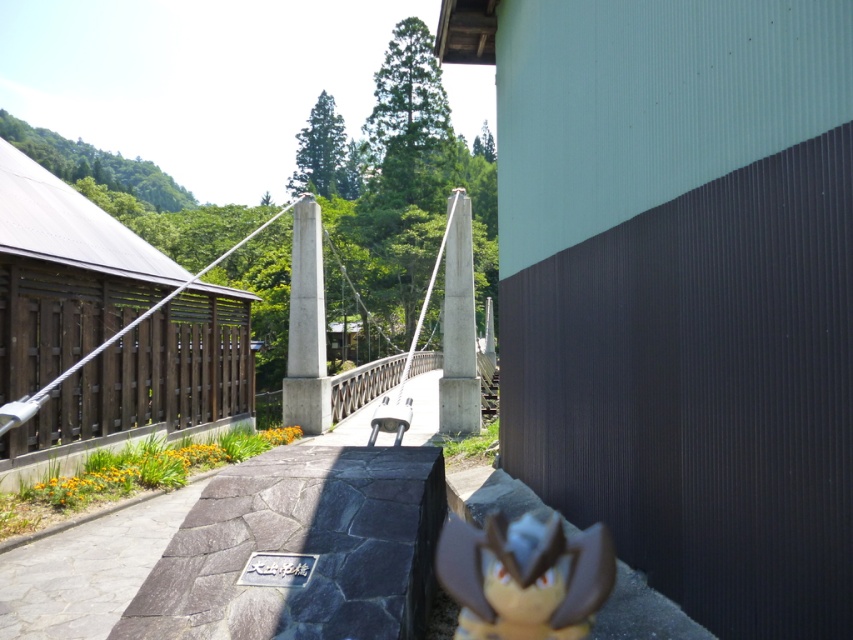
Question: Which point is closer to the camera taking this photo?

Choices:
 (A) (503, 614)
 (B) (369, 371)

Answer: (A)

Question: Does silver metallic rail at center appear on the left side of metallic silver bench at center?

Choices:
 (A) no
 (B) yes

Answer: (A)

Question: Which object is closer to the camera taking this photo?

Choices:
 (A) brown matte toy at lower center
 (B) silver metallic rail at center
 (C) metallic silver bench at center

Answer: (A)

Question: Can you confirm if brown matte toy at lower center is thinner than metallic silver bench at center?

Choices:
 (A) no
 (B) yes

Answer: (A)

Question: Can you confirm if silver metallic rail at center is positioned to the left of metallic silver bench at center?

Choices:
 (A) yes
 (B) no

Answer: (B)

Question: Which object is closer to the camera taking this photo?

Choices:
 (A) brown matte toy at lower center
 (B) silver metallic rail at center
 (C) metallic silver bench at center

Answer: (A)